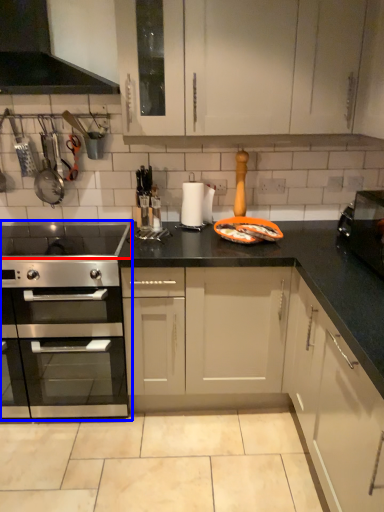
Question: Which of the following is the closest to the observer, gas stove (highlighted by a red box) or kitchen appliance (highlighted by a blue box)?

Choices:
 (A) gas stove
 (B) kitchen appliance

Answer: (A)